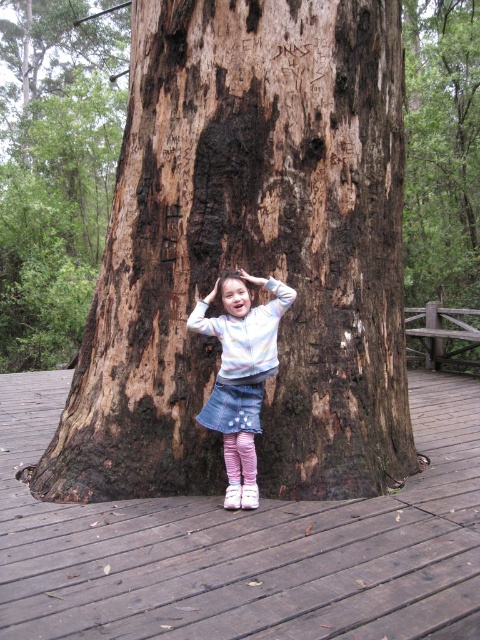
Can you confirm if wooden at lower center is positioned above denim skirt at center?

Incorrect, wooden at lower center is not positioned above denim skirt at center.

Between point (168, 609) and point (206, 328), which one is positioned behind?

Point (206, 328)

The width and height of the screenshot is (480, 640). Identify the location of wooden at lower center. (244, 545).

Between point (175, 88) and point (236, 394), which one is positioned behind?

The point (175, 88) is behind.

Where is `brown rough tree trunk at center`? This screenshot has height=640, width=480. brown rough tree trunk at center is located at coordinates (249, 252).

Who is more forward, (119, 349) or (2, 476)?

Point (119, 349)

This screenshot has height=640, width=480. Describe the element at coordinates (249, 252) in the screenshot. I see `brown rough tree trunk at center` at that location.

Identify the location of brown rough tree trunk at center. (249, 252).